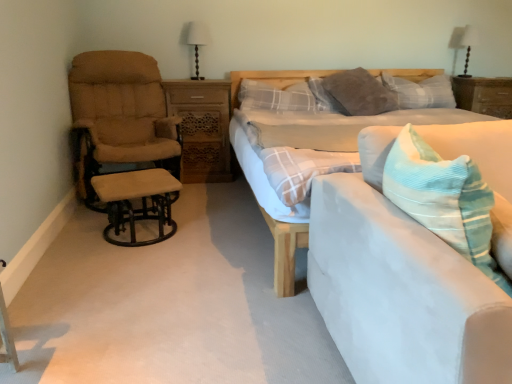
I want to click on free space that is in between beige fabric recliner at left and beige fabric stool at left, so click(179, 221).